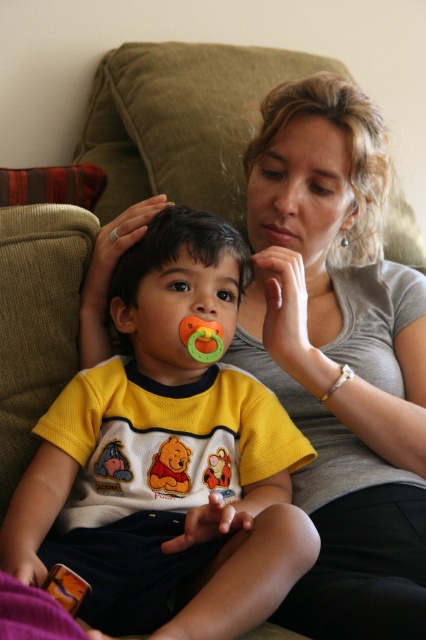
You are a photographer taking a picture of the yellow plush bear at center and the smooth skin mouth at center. Which object will appear larger in the photo?

The yellow plush bear at center will appear larger in the photo because it is closer to the viewer than the smooth skin mouth at center.

You are a photographer taking a picture of the scene. You notice two points in the image at coordinates point (193, 356) and point (114, 228). Which point is closer to your camera?

Point (193, 356) is closer to the camera than point (114, 228).